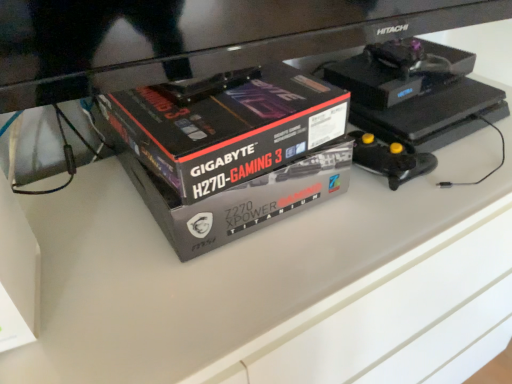
Question: Is matte black box at lower left, which is the first box from left to right, positioned beyond the bounds of black glossy box at center, the 1th box when ordered from right to left?

Choices:
 (A) no
 (B) yes

Answer: (B)

Question: Is black glossy box at center, which is the 2th box in left-to-right order, at the back of matte black box at lower left, which is the first box from left to right?

Choices:
 (A) yes
 (B) no

Answer: (B)

Question: Is matte black box at lower left, the second box when ordered from right to left, positioned far away from black glossy box at center, the 1th box when ordered from right to left?

Choices:
 (A) no
 (B) yes

Answer: (A)

Question: Considering the relative sizes of matte black box at lower left, which is the first box from left to right, and black glossy box at center, which is the 2th box in left-to-right order, in the image provided, is matte black box at lower left, which is the first box from left to right, smaller than black glossy box at center, which is the 2th box in left-to-right order,?

Choices:
 (A) yes
 (B) no

Answer: (A)

Question: From a real-world perspective, is matte black box at lower left, which is the first box from left to right, on black glossy box at center, which is the 2th box in left-to-right order?

Choices:
 (A) yes
 (B) no

Answer: (B)

Question: Can you confirm if matte black box at lower left, which is the first box from left to right, is wider than black glossy box at center, the 1th box when ordered from right to left?

Choices:
 (A) no
 (B) yes

Answer: (A)

Question: Does black glossy box at center, which is the 2th box in left-to-right order, come in front of matte black box at lower left, which is the first box from left to right?

Choices:
 (A) yes
 (B) no

Answer: (B)

Question: From the image's perspective, is black glossy box at center, the 1th box when ordered from right to left, on matte black box at lower left, which is the first box from left to right?

Choices:
 (A) no
 (B) yes

Answer: (B)

Question: Can you confirm if black glossy box at center, the 1th box when ordered from right to left, is smaller than matte black box at lower left, the second box when ordered from right to left?

Choices:
 (A) no
 (B) yes

Answer: (A)

Question: From the image's perspective, does black glossy box at center, the 1th box when ordered from right to left, appear lower than matte black box at lower left, which is the first box from left to right?

Choices:
 (A) no
 (B) yes

Answer: (A)

Question: Is black glossy box at center, the 1th box when ordered from right to left, shorter than matte black box at lower left, the second box when ordered from right to left?

Choices:
 (A) yes
 (B) no

Answer: (A)

Question: Is black glossy box at center, the 1th box when ordered from right to left, not within matte black box at lower left, the second box when ordered from right to left?

Choices:
 (A) yes
 (B) no

Answer: (A)

Question: Would you say matte black box at lower left, the second box when ordered from right to left, is to the left or to the right of black glossy box at center, which is the 2th box in left-to-right order, in the picture?

Choices:
 (A) left
 (B) right

Answer: (A)